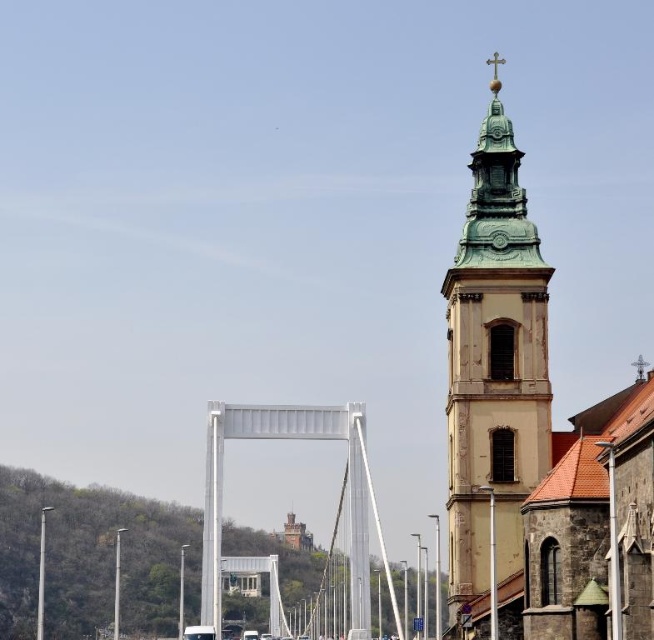
You are standing at the point closer to the camera in the image. Which point are you at, point [490,378] or point [353,429]?

You are at point [490,378] because it is closer to the camera than point [353,429].

You are standing at the center of the image and want to locate the green copper tower at right. Based on the coordinates provided, in which direction should you look to find it?

The green copper tower at right is located at coordinates 0.572 on the x axis and 0.757 on the y axis. Since the x coordinate is greater than 0.5, it is to the right of the center. The y coordinate is above 0.5, so it is also above the center. Therefore, you should look to the upper right direction to find the green copper tower at right.